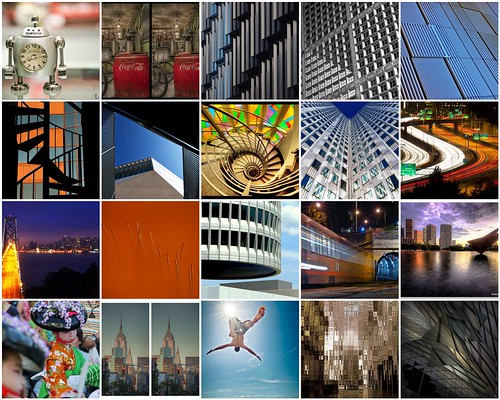
Locate an element on the screen. The height and width of the screenshot is (400, 500). the top row of photos is located at coordinates (72, 59), (151, 45), (266, 53), (355, 54), (445, 39).